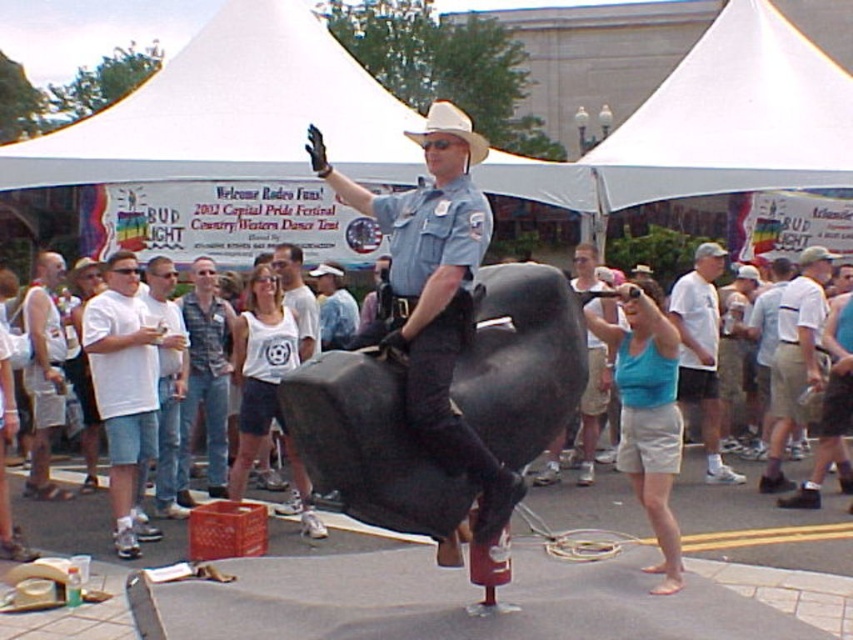
You are a photographer at the fair who wants to capture both the white cotton shirt at center and the denim shirt at center in a single photo. The camera you have can capture a maximum distance of 4 meters between subjects. Will you be able to include both shirts in the photo?

The white cotton shirt at center is 4.12 meters from the denim shirt at center. Since the camera can only capture up to 4 meters between subjects, the distance is too great to include both shirts in the photo.

You are a photographer at the fair and want to capture a photo of the two people wearing the white cotton shirt at center and denim shirt at center. Since you want to highlight both equally, which shirt should you position closer to the camera to make them appear the same size?

The white cotton shirt at center is taller than the denim shirt at center. To make them appear the same size in the photo, position the denim shirt at center closer to the camera since it is shorter. This way, its closer proximity will compensate for its smaller height, balancing their apparent sizes.